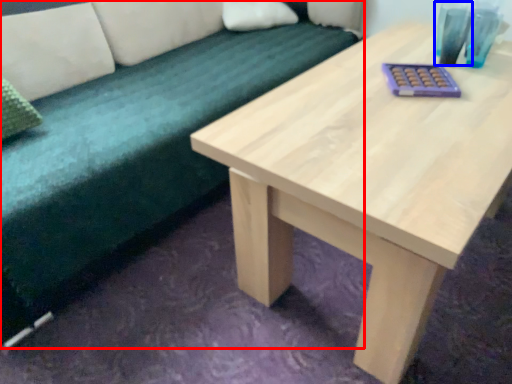
Question: Which object is further to the camera taking this photo, studio couch (highlighted by a red box) or glass vase (highlighted by a blue box)?

Choices:
 (A) studio couch
 (B) glass vase

Answer: (B)